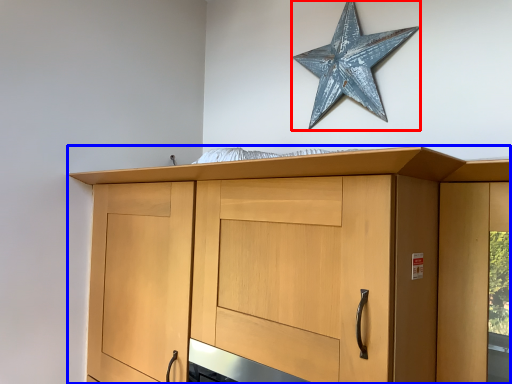
Question: Among these objects, which one is farthest to the camera, star (highlighted by a red box) or cupboard (highlighted by a blue box)?

Choices:
 (A) star
 (B) cupboard

Answer: (A)